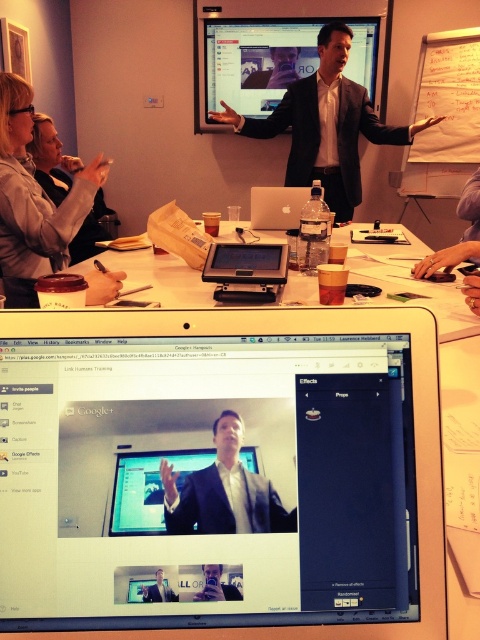
You are a participant in the conference room and need to locate the matte black monitor at center. According to the coordinates provided, where should you look in the image?

The matte black monitor at center is located at point coordinates of 0.762 on the x axis and 0.308 on the y axis.

You are setting up for a presentation and need to place a new projector screen to the right of the matte black monitor at upper center. According to the room layout, where should you position the projector screen?

The matte black monitor at upper center is located at point (276,58). To place the projector screen to its right, position it at a coordinate with an x value greater than 0.092 while maintaining the same y value of 0.575.

What is located at the coordinate point (276, 70) in the image?

The location at coordinate point (276, 70) has a matte black suit at upper center.